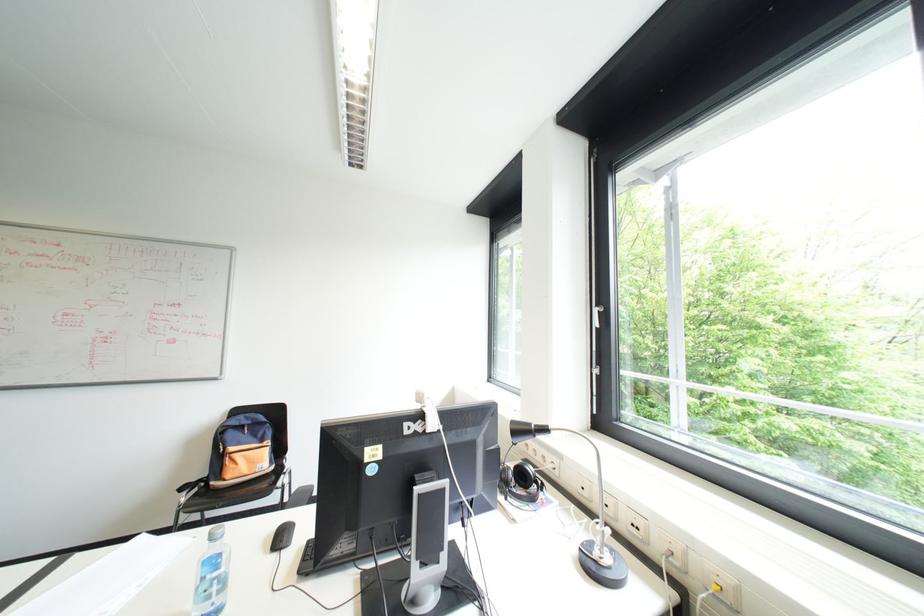
What do you see at coordinates (526, 430) in the screenshot? I see `a black lamp head` at bounding box center [526, 430].